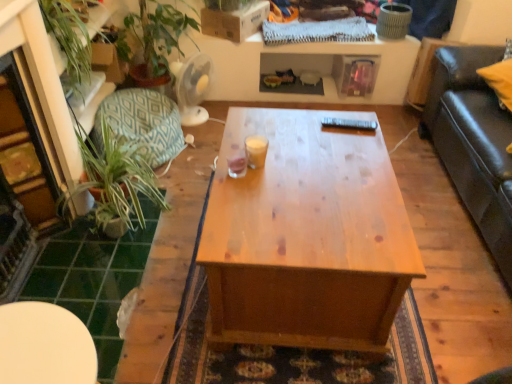
Locate an element on the screen. free space between green textured plant at lower left and green tile at lower left is located at coordinates (143, 286).